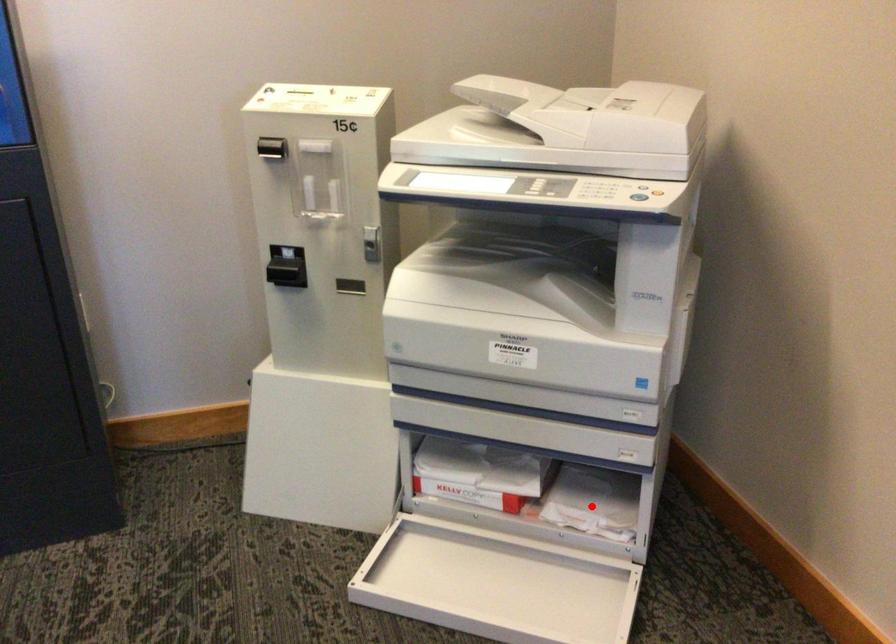
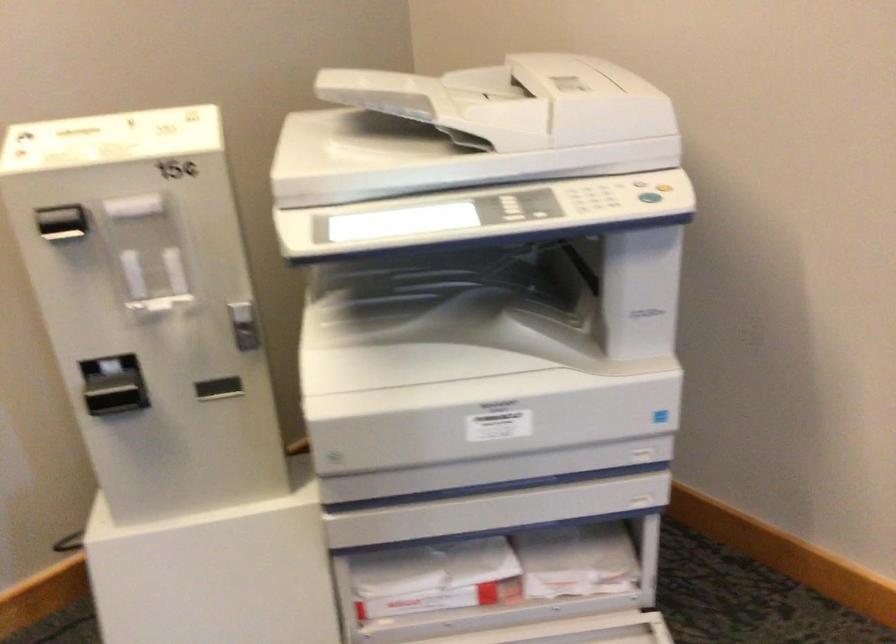
Where in the second image is the point corresponding to the highlighted location from the first image?

(576, 561)